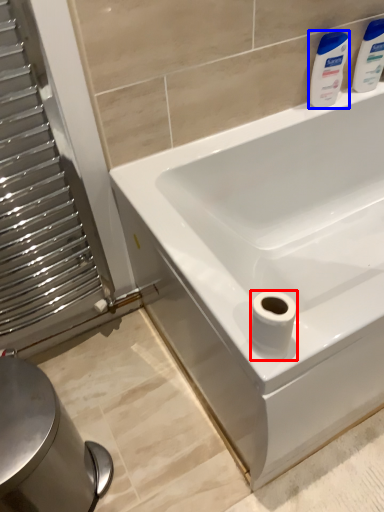
Question: Which point is closer to the camera, toilet paper (highlighted by a red box) or cleaning product (highlighted by a blue box)?

Choices:
 (A) toilet paper
 (B) cleaning product

Answer: (A)